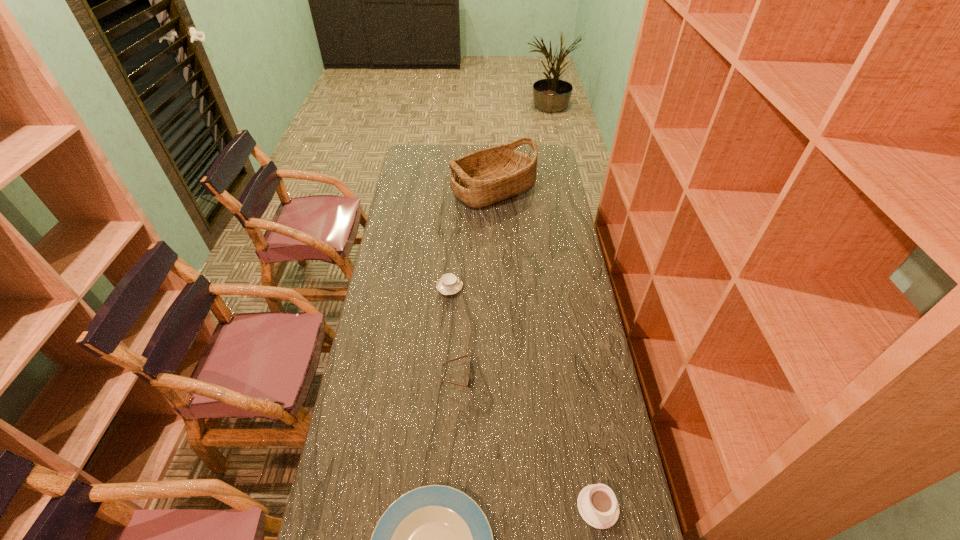
What are the coordinates of `vacant space that satisfies the following two spatial constraints: 1. on the frames of the third farthest object; 2. on the handle side of the right teacup` in the screenshot? It's located at (451, 507).